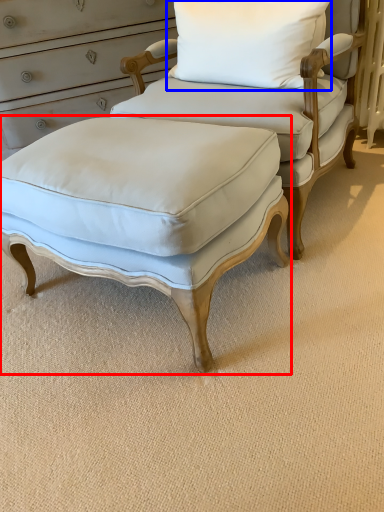
Question: Which object appears farthest to the camera in this image, stool (highlighted by a red box) or pillow (highlighted by a blue box)?

Choices:
 (A) stool
 (B) pillow

Answer: (B)